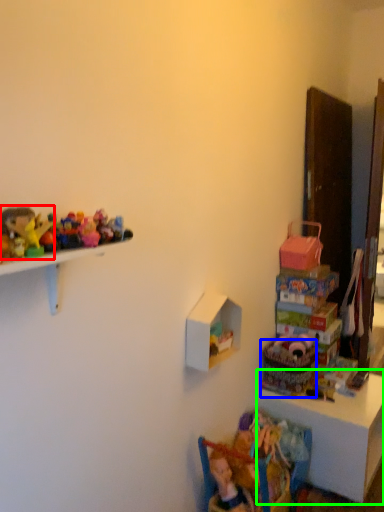
Question: Estimate the real-world distances between objects in this image. Which object is closer to toy (highlighted by a red box), basket (highlighted by a blue box) or table (highlighted by a green box)?

Choices:
 (A) basket
 (B) table

Answer: (A)